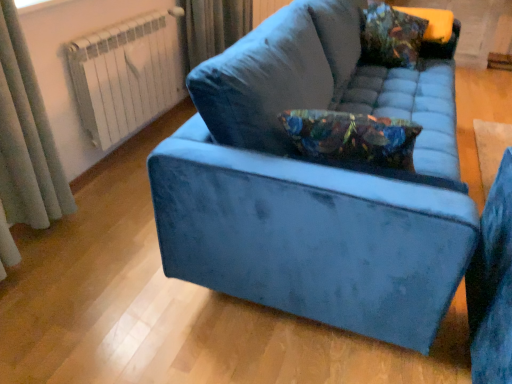
Question: Does point (98, 77) appear closer or farther from the camera than point (364, 46)?

Choices:
 (A) closer
 (B) farther

Answer: (A)

Question: Choose the correct answer: Is white metal radiator at upper left inside floral-patterned velvet pillow at upper right or outside it?

Choices:
 (A) outside
 (B) inside

Answer: (A)

Question: Which of these objects is positioned farthest from the gray fabric curtain at left?

Choices:
 (A) floral-patterned velvet pillow at upper right
 (B) velvet blue couch at center
 (C) white metal radiator at upper left

Answer: (A)

Question: Which object is the farthest from the floral-patterned velvet pillow at upper right?

Choices:
 (A) velvet blue couch at center
 (B) gray fabric curtain at left
 (C) white metal radiator at upper left

Answer: (B)